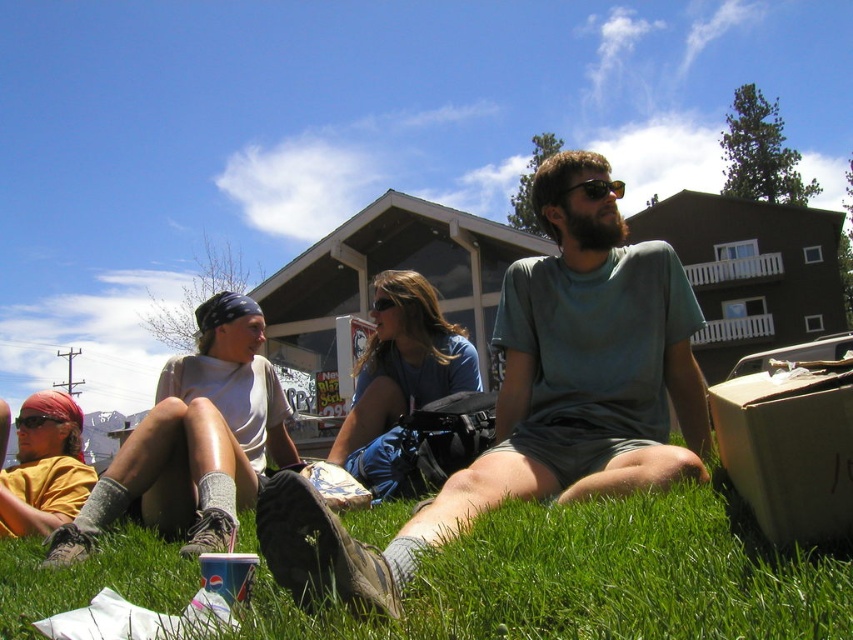
You are standing in the outdoor gathering scene. You want to pick up the matte black goggles at center without stepping on the green grass at lower center. Is this possible?

The green grass at lower center is closer to the viewer than the matte black goggles at center, so you can reach the matte black goggles at center without stepping on the green grass at lower center by moving around the grass area.